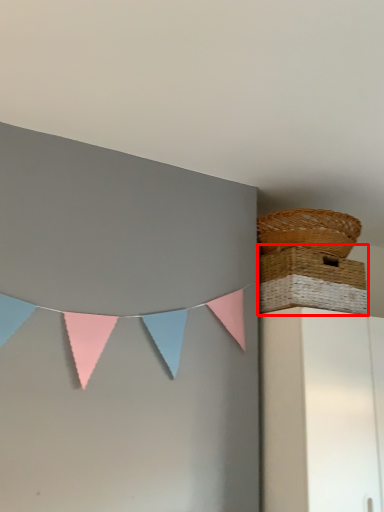
Question: From the image's perspective, what is the correct spatial relationship of picnic basket (annotated by the red box) in relation to picnic basket?

Choices:
 (A) above
 (B) below

Answer: (B)